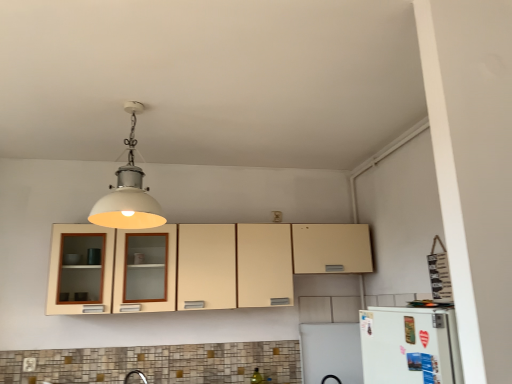
Describe the element at coordinates (410, 345) in the screenshot. The height and width of the screenshot is (384, 512). I see `white matte refrigerator at lower right` at that location.

This screenshot has width=512, height=384. I want to click on beige matte cabinet at center, so click(246, 261).

From the picture: Does white matte light fixture at upper center touch white matte refrigerator at lower right?

No, white matte light fixture at upper center is not with white matte refrigerator at lower right.

Which object is closer to the camera taking this photo, white matte light fixture at upper center or white matte refrigerator at lower right?

Positioned in front is white matte refrigerator at lower right.

Is white matte light fixture at upper center turned away from white matte refrigerator at lower right?

No, white matte light fixture at upper center is not facing away from white matte refrigerator at lower right.

Between white matte light fixture at upper center and white matte refrigerator at lower right, which one has less height?

With less height is white matte refrigerator at lower right.

Is beige matte cabinet at center smaller than white matte light fixture at upper center?

Incorrect, beige matte cabinet at center is not smaller in size than white matte light fixture at upper center.

Which is behind, point (236, 261) or point (95, 219)?

The point (236, 261) is farther.

Could white matte light fixture at upper center be considered to be inside beige matte cabinet at center?

No, beige matte cabinet at center does not contain white matte light fixture at upper center.

Which object is positioned more to the right, matte white electric outlet at lower left or beige matte cabinet at center?

Positioned to the right is beige matte cabinet at center.

Measure the distance between matte white electric outlet at lower left and beige matte cabinet at center.

They are 4.91 feet apart.

From a real-world perspective, is matte white electric outlet at lower left over beige matte cabinet at center?

Incorrect, from a real-world perspective, matte white electric outlet at lower left is lower than beige matte cabinet at center.

Looking at their sizes, would you say matte white electric outlet at lower left is wider or thinner than beige matte cabinet at center?

Clearly, matte white electric outlet at lower left has less width compared to beige matte cabinet at center.

You are a GUI agent. You are given a task and a screenshot of the screen. Output one action in this format:
    pyautogui.click(x=<x>, y=<y>)
    Task: Click on the cabinetry on the left of white matte refrigerator at lower right
    The height and width of the screenshot is (384, 512).
    Given the screenshot: What is the action you would take?
    pyautogui.click(x=246, y=261)

Is beige matte cabinet at center oriented towards white matte refrigerator at lower right?

Yes, beige matte cabinet at center is oriented towards white matte refrigerator at lower right.

Between beige matte cabinet at center and matte white electric outlet at lower left, which one is positioned in front?

beige matte cabinet at center is closer to the camera.

In the image, is beige matte cabinet at center on the left side or the right side of matte white electric outlet at lower left?

Clearly, beige matte cabinet at center is on the right of matte white electric outlet at lower left in the image.

Is beige matte cabinet at center wider than matte white electric outlet at lower left?

Yes, beige matte cabinet at center is wider than matte white electric outlet at lower left.

Is the surface of beige matte cabinet at center in direct contact with matte white electric outlet at lower left?

No, beige matte cabinet at center is not making contact with matte white electric outlet at lower left.

Is white matte refrigerator at lower right situated inside beige matte cabinet at center or outside?

The correct answer is: outside.

Looking at this image, is white matte refrigerator at lower right oriented towards beige matte cabinet at center?

No, white matte refrigerator at lower right is not oriented towards beige matte cabinet at center.

This screenshot has width=512, height=384. I want to click on cabinetry that is above the white matte refrigerator at lower right (from a real-world perspective), so click(246, 261).

Is matte white electric outlet at lower left positioned with its back to white matte refrigerator at lower right?

No.

Relative to white matte refrigerator at lower right, is matte white electric outlet at lower left in front or behind?

Clearly, matte white electric outlet at lower left is behind white matte refrigerator at lower right.

The width and height of the screenshot is (512, 384). Identify the location of electric outlet on the left of white matte refrigerator at lower right. (29, 364).

From a real-world perspective, which object stands above the other?

In real-world perspective, white matte refrigerator at lower right is above.

I want to click on light fixture above the white matte refrigerator at lower right (from a real-world perspective), so click(x=128, y=192).

Identify the location of light fixture on the left of beige matte cabinet at center. (128, 192).

When comparing their distances from white matte light fixture at upper center, does matte white electric outlet at lower left or beige matte cabinet at center seem closer?

beige matte cabinet at center is closer to white matte light fixture at upper center.

Based on the photo, when comparing their distances from beige matte cabinet at center, does white matte light fixture at upper center or matte white electric outlet at lower left seem closer?

white matte light fixture at upper center is positioned closer to the anchor beige matte cabinet at center.

When comparing their distances from beige matte cabinet at center, does matte white electric outlet at lower left or white matte light fixture at upper center seem further?

Based on the image, matte white electric outlet at lower left appears to be further to beige matte cabinet at center.

Considering their positions, is white matte refrigerator at lower right positioned closer to white matte light fixture at upper center than beige matte cabinet at center?

beige matte cabinet at center is closer to white matte light fixture at upper center.

When comparing their distances from white matte refrigerator at lower right, does beige matte cabinet at center or white matte light fixture at upper center seem further?

Among the two, beige matte cabinet at center is located further to white matte refrigerator at lower right.

Considering their positions, is white matte refrigerator at lower right positioned further to beige matte cabinet at center than white matte light fixture at upper center?

white matte refrigerator at lower right is further to beige matte cabinet at center.

Looking at the image, which one is located closer to white matte refrigerator at lower right, matte white electric outlet at lower left or beige matte cabinet at center?

beige matte cabinet at center lies closer to white matte refrigerator at lower right than the other object.

Based on their spatial positions, is beige matte cabinet at center or white matte light fixture at upper center further from matte white electric outlet at lower left?

beige matte cabinet at center is further to matte white electric outlet at lower left.

Where is `cabinetry that lies between white matte light fixture at upper center and matte white electric outlet at lower left from top to bottom`? Image resolution: width=512 pixels, height=384 pixels. cabinetry that lies between white matte light fixture at upper center and matte white electric outlet at lower left from top to bottom is located at coordinates (246, 261).

The height and width of the screenshot is (384, 512). Identify the location of light fixture located between white matte refrigerator at lower right and beige matte cabinet at center in the depth direction. (128, 192).

You are a GUI agent. You are given a task and a screenshot of the screen. Output one action in this format:
    pyautogui.click(x=<x>, y=<y>)
    Task: Click on the light fixture between matte white electric outlet at lower left and white matte refrigerator at lower right
    
    Given the screenshot: What is the action you would take?
    pyautogui.click(x=128, y=192)

I want to click on cabinetry between matte white electric outlet at lower left and white matte refrigerator at lower right from left to right, so click(x=246, y=261).